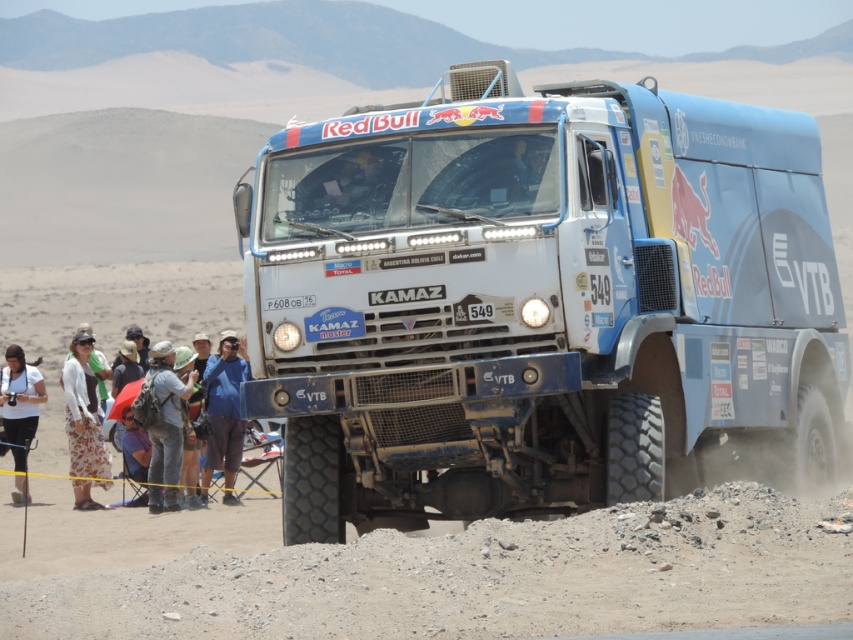
Who is lower down, blue denim jacket at lower left or sandy rubber tire at lower right?

blue denim jacket at lower left is below.

Is point (28, 404) farther from camera compared to point (824, 484)?

Yes, it is behind point (824, 484).

The width and height of the screenshot is (853, 640). What are the coordinates of `blue denim jacket at lower left` in the screenshot? It's located at (84, 422).

Who is positioned more to the right, blue denim jacket at lower left or black rubber tire at lower center?

black rubber tire at lower center

Which is above, blue denim jacket at lower left or black rubber tire at lower center?

Positioned higher is black rubber tire at lower center.

Is point (154, 502) positioned behind point (286, 540)?

Yes, point (154, 502) is behind point (286, 540).

At what (x,y) coordinates should I click in order to perform the action: click on blue denim jacket at lower left. Please return your answer as a coordinate pair (x, y). This screenshot has height=640, width=853. Looking at the image, I should click on click(84, 422).

Is black rubber tire at lower center below sandy rubber tire at lower right?

Yes, black rubber tire at lower center is below sandy rubber tire at lower right.

Looking at this image, who is more forward, (322, 460) or (824, 406)?

Point (322, 460)

What do you see at coordinates (311, 481) in the screenshot? I see `black rubber tire at lower center` at bounding box center [311, 481].

Where is `black rubber tire at lower center`? The height and width of the screenshot is (640, 853). black rubber tire at lower center is located at coordinates (311, 481).